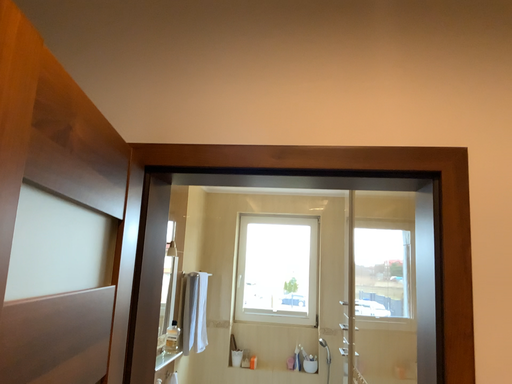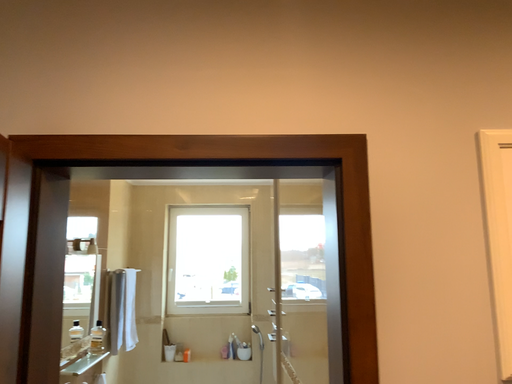
Question: Which way did the camera rotate in the video?

Choices:
 (A) rotated right
 (B) rotated left

Answer: (A)